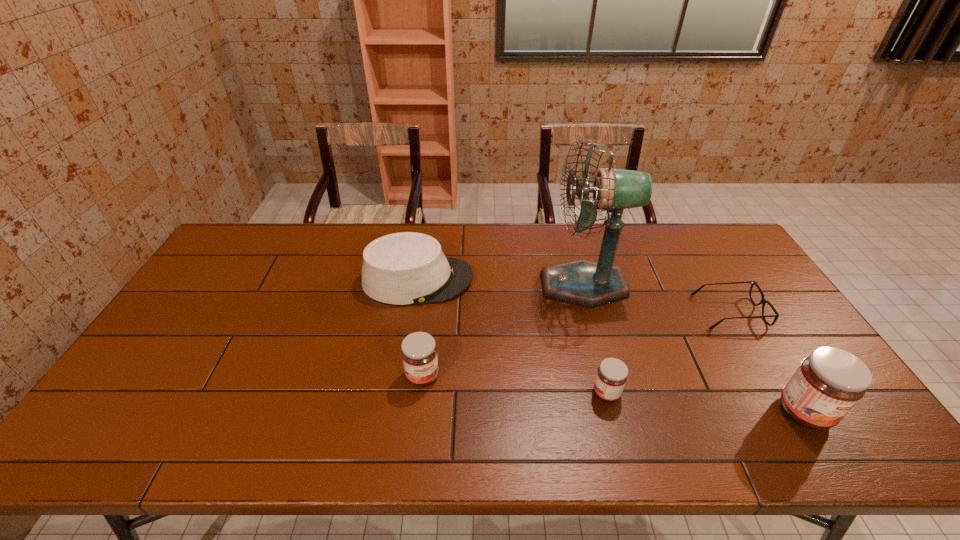
In the current image, all jams are evenly spaced. To maintain this equal spacing, where should an additional jam be placed on the left? Please point out a free spot. Please provide its 2D coordinates. Your answer should be formatted as a tuple, i.e. [(x, y)], where the tuple contains the x and y coordinates of a point satisfying the conditions above.

[(251, 360)]